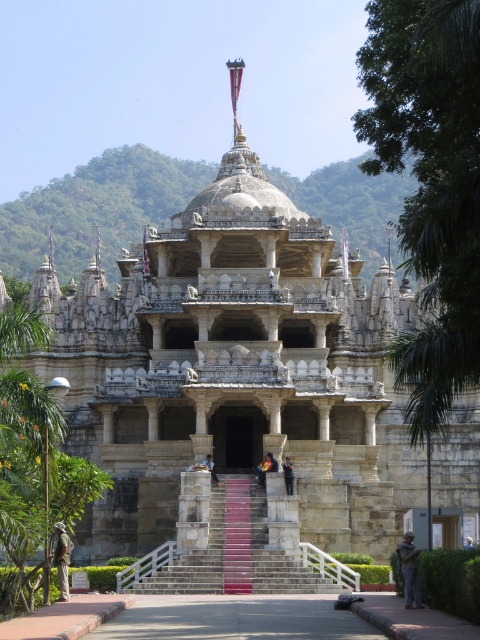
Consider the image. Does polished stone stairs at center appear on the left side of dark blue fabric at center?

In fact, polished stone stairs at center is to the right of dark blue fabric at center.

Looking at this image, who is more distant from viewer, [232,477] or [204,464]?

Positioned behind is point [232,477].

This screenshot has width=480, height=640. What do you see at coordinates (237, 556) in the screenshot?
I see `polished stone stairs at center` at bounding box center [237, 556].

In order to click on polished stone stairs at center in this screenshot , I will do `click(237, 556)`.

Is camouflage fabric jacket at lower right further to camera compared to camouflage fabric jacket at lower left?

That is False.

Where is `camouflage fabric jacket at lower right`? The height and width of the screenshot is (640, 480). camouflage fabric jacket at lower right is located at coordinates (408, 570).

Is point (399, 552) positioned before point (63, 572)?

No, it is not.

Where is `camouflage fabric jacket at lower right`? This screenshot has width=480, height=640. camouflage fabric jacket at lower right is located at coordinates (408, 570).

Is dark gray stone person at center closer to the viewer compared to dark blue fabric at center?

Yes, it is in front of dark blue fabric at center.

Which is behind, point (285, 474) or point (211, 464)?

Point (211, 464)

You are a GUI agent. You are given a task and a screenshot of the screen. Output one action in this format:
    pyautogui.click(x=<x>, y=<y>)
    Task: Click on the dark gray stone person at center
    
    Given the screenshot: What is the action you would take?
    pyautogui.click(x=288, y=476)